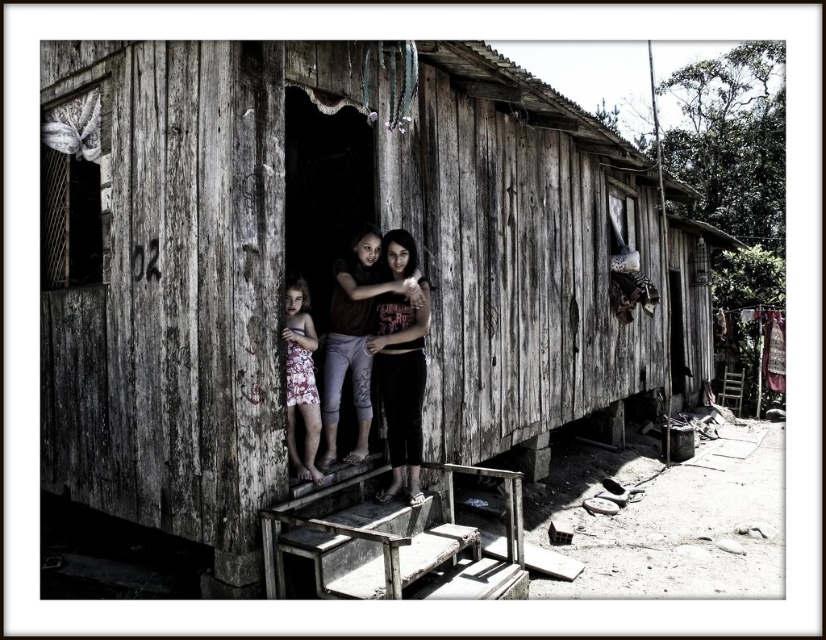
You are a tailor measuring the distance between two clothing items on a mannequin. The dark brown fabric pants at center and the matte brown shirt at center are placed on the mannequin. If your measuring tape shows that the distance between them is 7.52 inches, is this within the standard 8 inches maximum recommended for proper fitting? Please answer based on the given information.

The dark brown fabric pants at center is 7.52 inches away from the matte brown shirt at center, which is within the standard 8 inches maximum recommended for proper fitting.

You are a photographer trying to capture a closeup of the dark brown fabric pants at center and the matte brown shirt at center. Which one should you focus on to ensure it appears clearer in the photo?

The dark brown fabric pants at center is closer to the viewer than the matte brown shirt at center, so focusing on the dark brown fabric pants at center will ensure it appears clearer in the photo.

You are standing in front of the weathered wood hut at center and the floral dress at center. Which object is closer to you?

The weathered wood hut at center is closer to you because it is positioned in front of the floral dress at center.